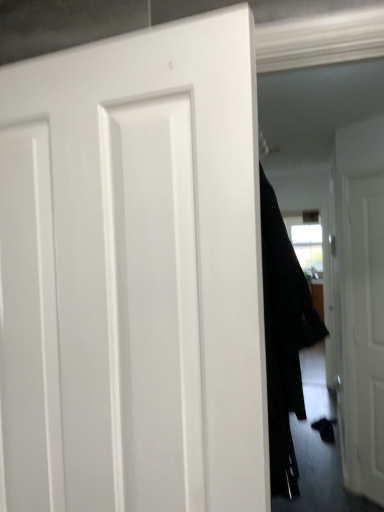
Question: Based on their sizes in the image, would you say white matte door at right, the 2th door in the front-to-back sequence, is bigger or smaller than black fabric coat at center?

Choices:
 (A) small
 (B) big

Answer: (A)

Question: Is white matte door at right, the 2th door in the front-to-back sequence, situated inside black fabric coat at center or outside?

Choices:
 (A) inside
 (B) outside

Answer: (B)

Question: Which object is positioned closest to the black fabric coat at center?

Choices:
 (A) white matte door at right, the 2th door in the front-to-back sequence
 (B) white matte door at center, marked as the 2th door in a back-to-front arrangement

Answer: (B)

Question: Which is nearer to the white matte door at center, the first door from the left?

Choices:
 (A) black fabric coat at center
 (B) white matte door at right, positioned as the 1th door in back-to-front order

Answer: (A)